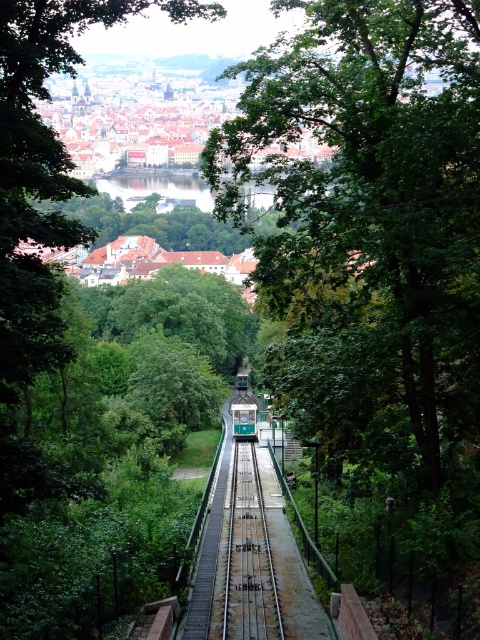
You are standing at the camera position and want to take a photo of the green leafy tree at upper center. If your camera has a maximum focus range of 100 feet, will you be able to capture it clearly?

The distance between the green leafy tree at upper center and the camera is 100.63 feet, which exceeds the camera maximum focus range of 100 feet. Therefore, the camera will not be able to capture the green leafy tree at upper center clearly.

You are standing at the bottom of the incline near the green and white tram. Looking up towards the elevated vantage point, you notice a green leafy tree at upper center. What are the 2D coordinates of this tree in the image?

The 2D coordinates of the green leafy tree at upper center are at point (44, 168).